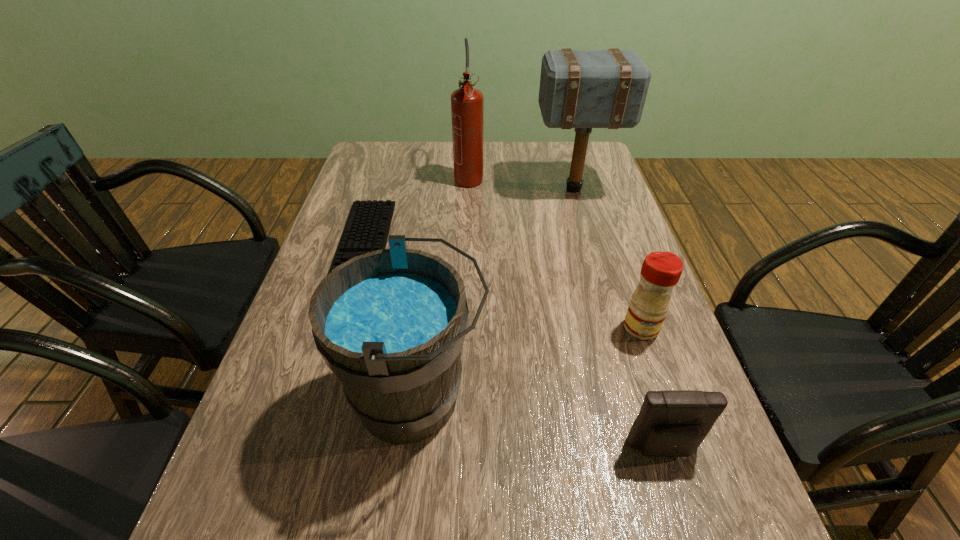
What are the coordinates of `blank area in the image that satisfies the following two spatial constraints: 1. on the front side of the fourth farthest object; 2. with a handle on the side of the wine bucket` in the screenshot? It's located at (665, 398).